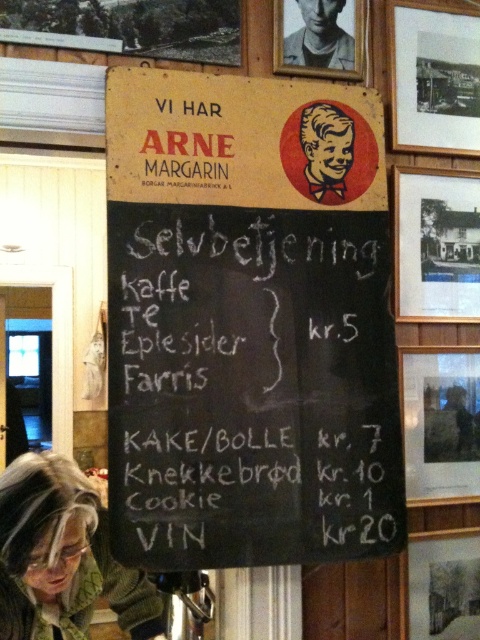
You are standing in front of the menu board and want to place a small sticker on the black matte picture frame at upper right. What are the coordinates where you should place the sticker?

The coordinates for the black matte picture frame at upper right are at point (436, 244).

You are a customer standing at the counter in the cafe and want to read the wooden frame at upper right. Can you reach it without moving your position?

The wooden frame at upper right is 1.77 meters away from camera, so you can reach it without moving your position if you can stretch your arm that far. However, typical arm length for an adult is about 0.7 meters, so you would need to move closer to read it comfortably.